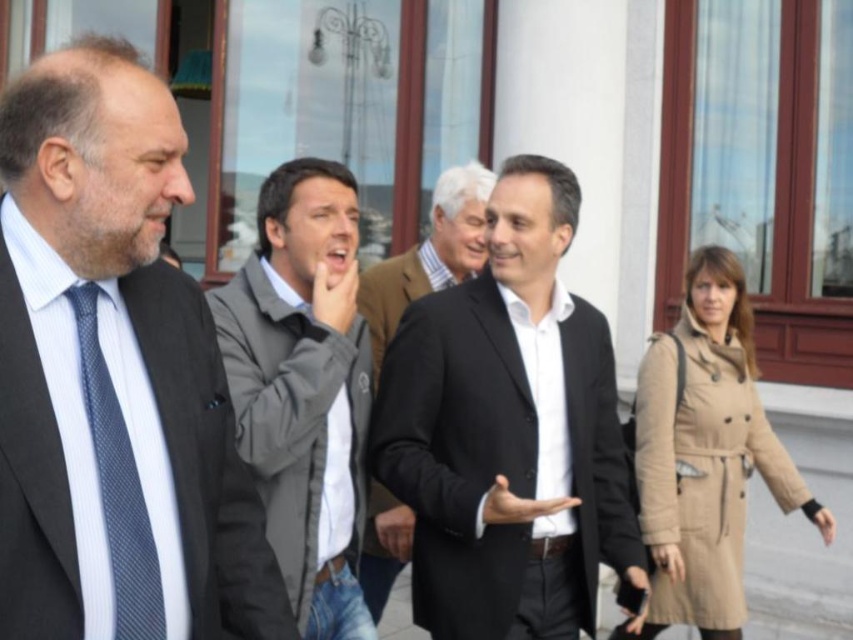
Question: Which point is closer to the camera taking this photo?

Choices:
 (A) (12, 560)
 (B) (300, 536)

Answer: (A)

Question: Can you confirm if black wool suit at center is smaller than blue textured tie at left?

Choices:
 (A) no
 (B) yes

Answer: (A)

Question: Which point appears farthest from the camera in this image?

Choices:
 (A) (97, 452)
 (B) (444, 253)
 (C) (338, 572)
 (D) (387, 413)

Answer: (B)

Question: Is matte black suit at left bigger than black wool coat at center?

Choices:
 (A) no
 (B) yes

Answer: (A)

Question: Is matte black suit at left thinner than black wool suit at center?

Choices:
 (A) yes
 (B) no

Answer: (A)

Question: Among these objects, which one is nearest to the camera?

Choices:
 (A) gray fabric jacket at center
 (B) matte black suit at left

Answer: (B)